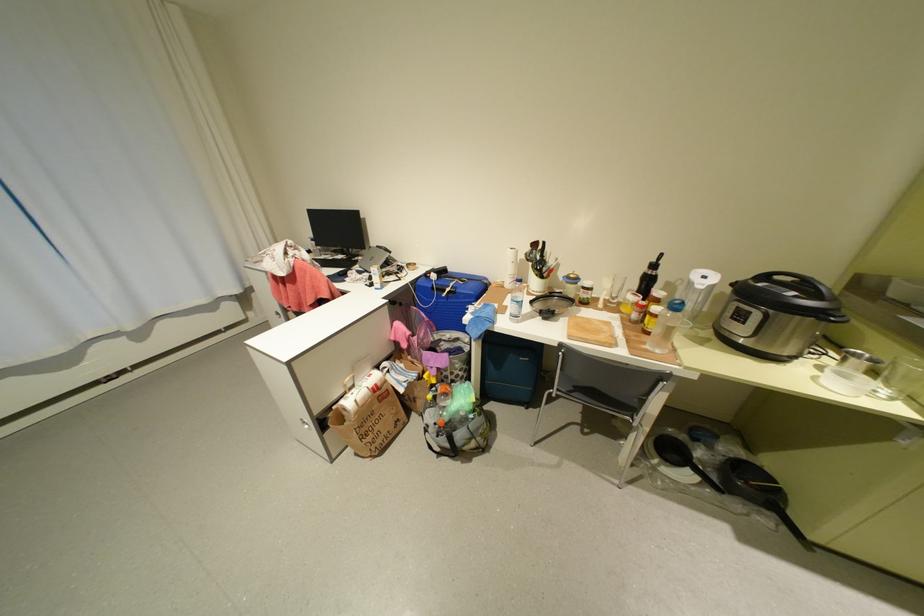
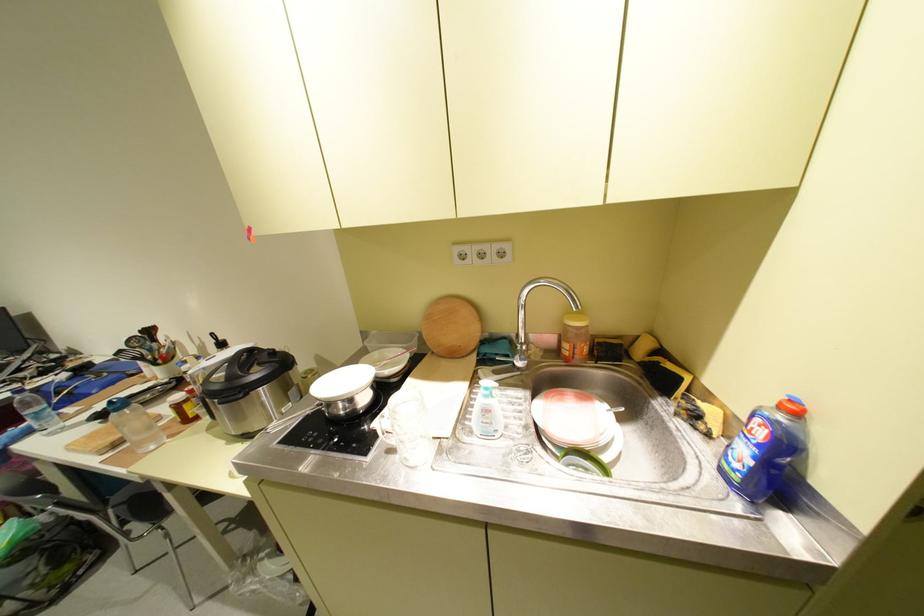
Question: Which direction would the cameraman need to move to produce the second image? Reply with the corresponding letter.

Choices:
 (A) Left
 (B) Right
 (C) Forward
 (D) Backward

Answer: (B)